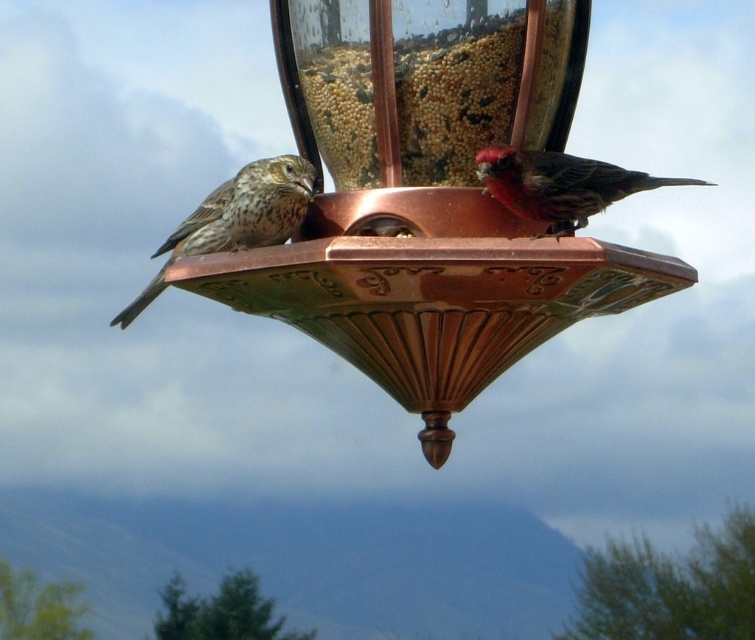
You are standing at the camera position and want to throw a small stone to hit the copper metallic bird feeder at center. The stone can travel up to 5 meters. Will it reach the feeder?

The copper metallic bird feeder at center is 6.01 meters away from the camera, which is beyond the stone throwing distance of 5 meters. Therefore, the stone will not reach the feeder.

You are a bird with a wingspan of 15 cm. You want to land on the copper metallic bird feeder at center and the brown speckled sparrow at left. Which one can you land on without overlapping your wings?

The copper metallic bird feeder at center has a width larger than the brown speckled sparrow at left. Since your wingspan is 15 cm, you can land on the copper metallic bird feeder at center as it provides enough space, but the brown speckled sparrow at left may be too narrow for your wingspan.